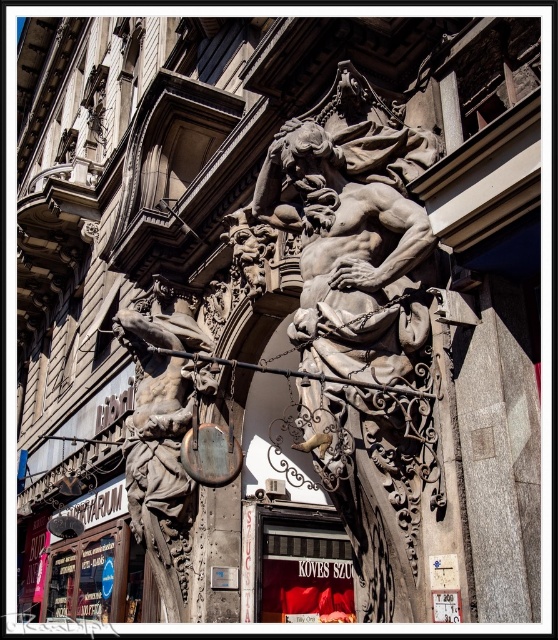
You are an art conservator examining the architectural details of this facade. You need to assess the placement of the gray stone sculpture at center and the polished bronze statue at left. Which sculpture is positioned higher in the structure?

The gray stone sculpture at center is positioned higher than the polished bronze statue at left because it is above it in the structure.

You are an art conservator assessing the structural stability of the two sculptures. Given that the gray stone sculpture at center is heavier than the polished bronze statue at left, which sculpture requires a more robust support system to prevent toppling?

The gray stone sculpture at center requires a more robust support system because it is taller and heavier than the polished bronze statue at left, making it more prone to toppling without proper reinforcement.